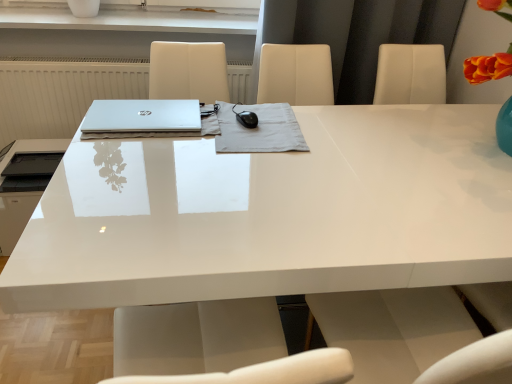
Image resolution: width=512 pixels, height=384 pixels. I want to click on vacant area to the right of satin black mouse at center, so click(x=361, y=142).